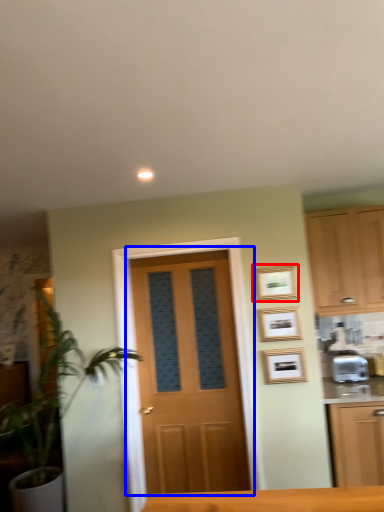
Question: Which object is closer to the camera taking this photo, picture frame (highlighted by a red box) or door (highlighted by a blue box)?

Choices:
 (A) picture frame
 (B) door

Answer: (A)